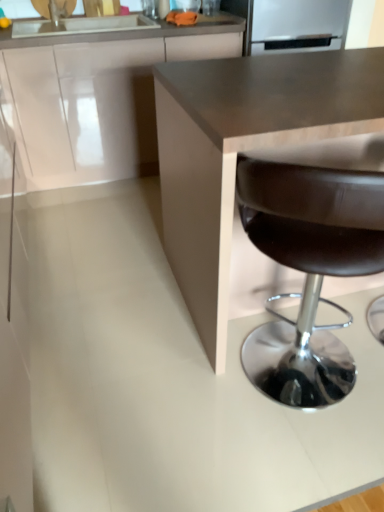
The height and width of the screenshot is (512, 384). What are the coordinates of `vacant area to the left of brown leather stool at lower right` in the screenshot? It's located at (160, 378).